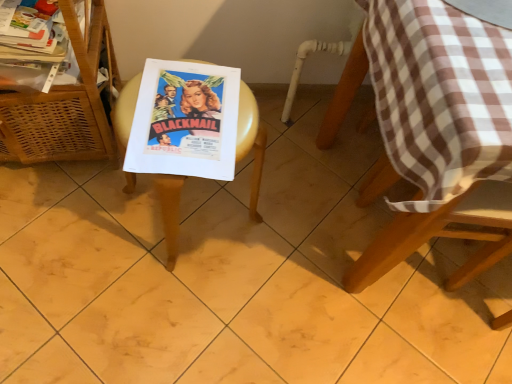
Locate an element on the screen. This screenshot has height=384, width=512. vacant area on top of wooden picnic table at center (from a real-world perspective) is located at coordinates (183, 115).